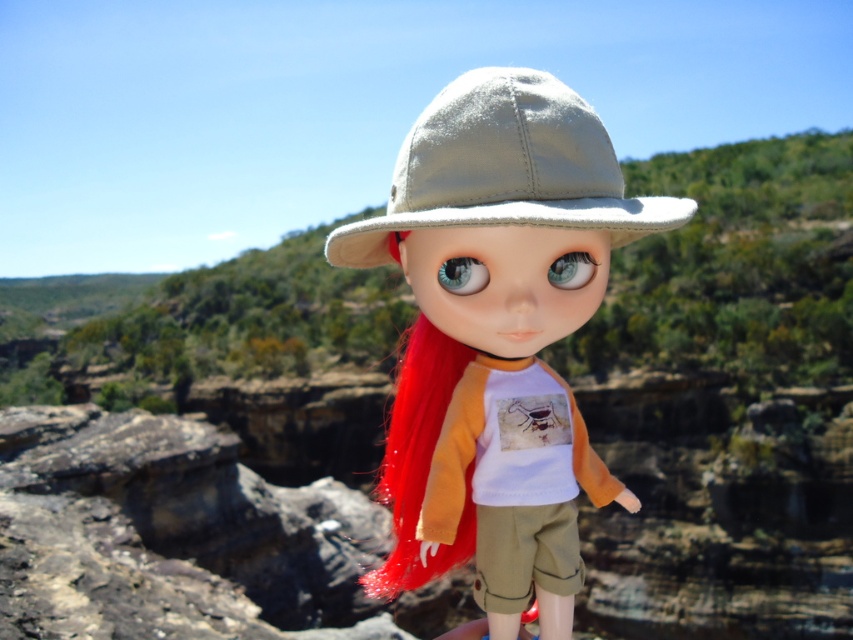
You are a fashion designer who wants to display two hats side by side in a store window. The store window has a shelf that is 3 feet wide. You have the satin beige hat at center and the satin beige fedora at center. Can both hats fit on the shelf without overlapping?

The satin beige hat at center and satin beige fedora at center are 3.60 feet apart, which is wider than the 3 feet shelf. Therefore, both hats cannot fit on the shelf without overlapping.

You are a photographer setting up a shot of the doll. You notice two hats on the doll, the satin beige hat at center and the satin beige fedora at center. Which hat is placed lower on the doll?

The satin beige hat at center is positioned under the satin beige fedora at center, so it is placed lower on the doll.